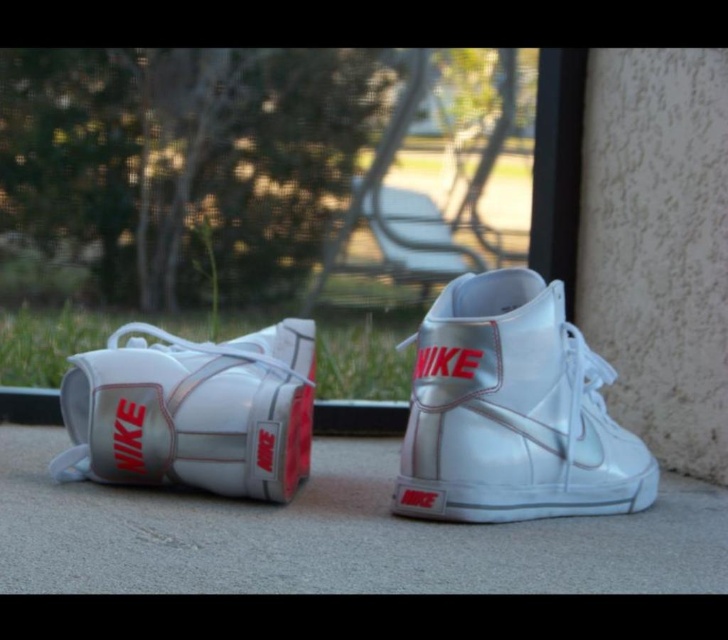
Question: Can you confirm if metallic white sneaker at center is bigger than metallic white sneaker at left?

Choices:
 (A) no
 (B) yes

Answer: (B)

Question: Is metallic white sneaker at center thinner than metallic white sneaker at left?

Choices:
 (A) no
 (B) yes

Answer: (A)

Question: Does metallic white sneaker at center appear under metallic white sneaker at left?

Choices:
 (A) no
 (B) yes

Answer: (A)

Question: Which object is farther from the camera taking this photo?

Choices:
 (A) metallic white sneaker at left
 (B) metallic white sneaker at center

Answer: (A)

Question: Which of the following is the farthest from the observer?

Choices:
 (A) metallic white sneaker at left
 (B) metallic white sneaker at center

Answer: (A)